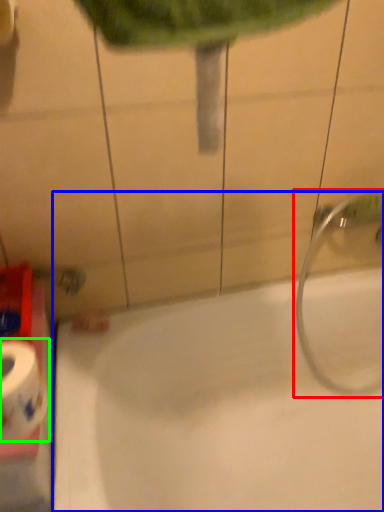
Question: Based on their relative distances, which object is nearer to plumbing fixture (highlighted by a red box)? Choose from bathtub (highlighted by a blue box) and toilet paper (highlighted by a green box).

Choices:
 (A) bathtub
 (B) toilet paper

Answer: (A)